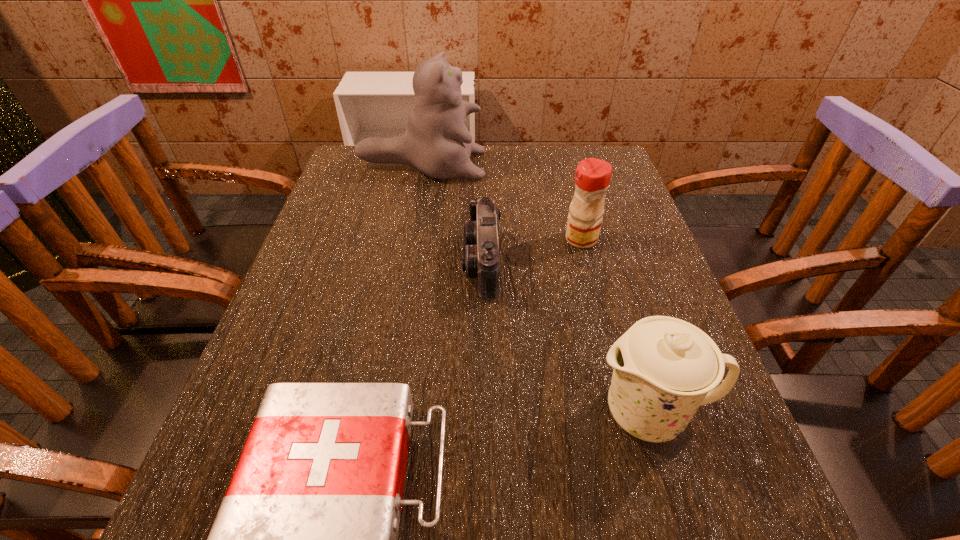
This screenshot has width=960, height=540. Identify the location of free location located 0.060m on the front-facing side of the camcorder. (437, 263).

Identify the location of vacant space located on the front-facing side of the camcorder. (370, 263).

Where is `vacant space situated 0.170m on the front-facing side of the camcorder`? This screenshot has height=540, width=960. vacant space situated 0.170m on the front-facing side of the camcorder is located at coordinates point(387,263).

Where is `object that is at the far edge`? object that is at the far edge is located at coordinates (436, 142).

The height and width of the screenshot is (540, 960). I want to click on object that is at the left edge, so click(436, 142).

Image resolution: width=960 pixels, height=540 pixels. I want to click on condiment that is at the right edge, so click(x=592, y=178).

Locate an element on the screen. chinaware at the right edge is located at coordinates (664, 368).

Locate an element on the screen. The height and width of the screenshot is (540, 960). object that is at the far left corner is located at coordinates (436, 142).

In the image, there is a desktop. Identify the location of vacant space at the far edge. This screenshot has width=960, height=540. (502, 146).

In order to click on free space at the near edge of the desktop in this screenshot , I will do `click(559, 506)`.